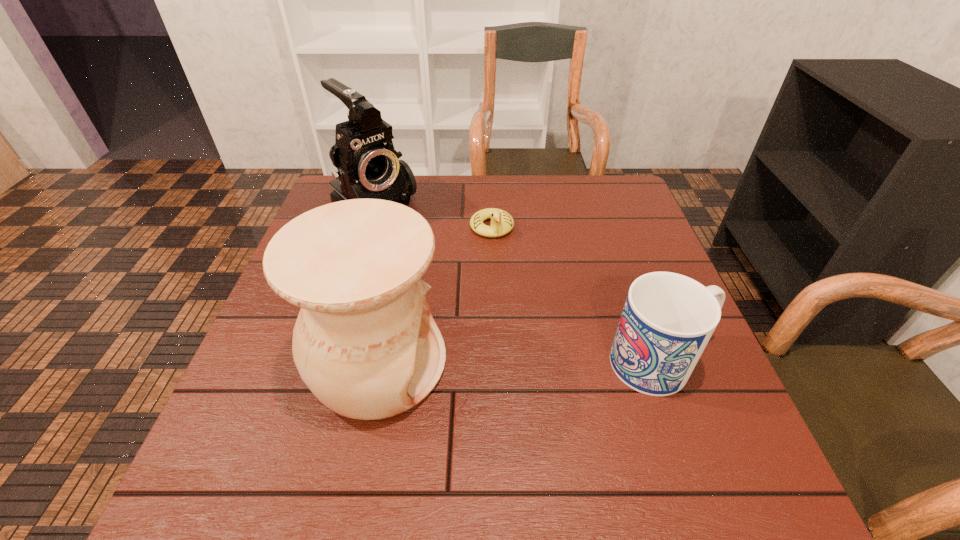
This screenshot has width=960, height=540. I want to click on unoccupied position between the shortest object and the pottery, so click(x=435, y=295).

The image size is (960, 540). What are the coordinates of `empty space that is in between the third object from left to right and the mug` in the screenshot? It's located at (578, 295).

In order to click on empty space between the third tallest object and the third object from left to right in this screenshot , I will do `click(578, 295)`.

Identify the location of vacant region between the mug and the pottery. (520, 363).

Locate an element on the screen. The height and width of the screenshot is (540, 960). unoccupied position between the shortest object and the mug is located at coordinates (578, 295).

I want to click on vacant area between the third tallest object and the shortest object, so click(578, 295).

What are the coordinates of `object that stands as the closest to the mug` in the screenshot? It's located at (365, 343).

Choose which object is the second nearest neighbor to the second object from right to left. Please provide its 2D coordinates. Your answer should be formatted as a tuple, i.e. [(x, y)], where the tuple contains the x and y coordinates of a point satisfying the conditions above.

[(365, 343)]

In order to click on free space that satisfies the following two spatial constraints: 1. on the front side of the camcorder; 2. at the open side of the pottery in this screenshot , I will do `click(328, 363)`.

The height and width of the screenshot is (540, 960). In order to click on vacant space that satisfies the following two spatial constraints: 1. on the front side of the camcorder; 2. on the right side of the rightmost object in this screenshot , I will do `click(328, 363)`.